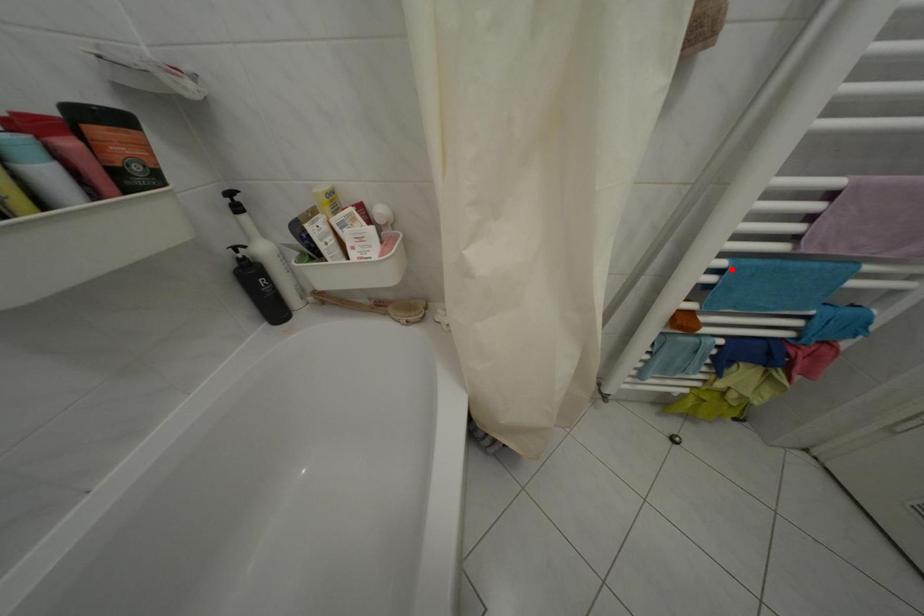
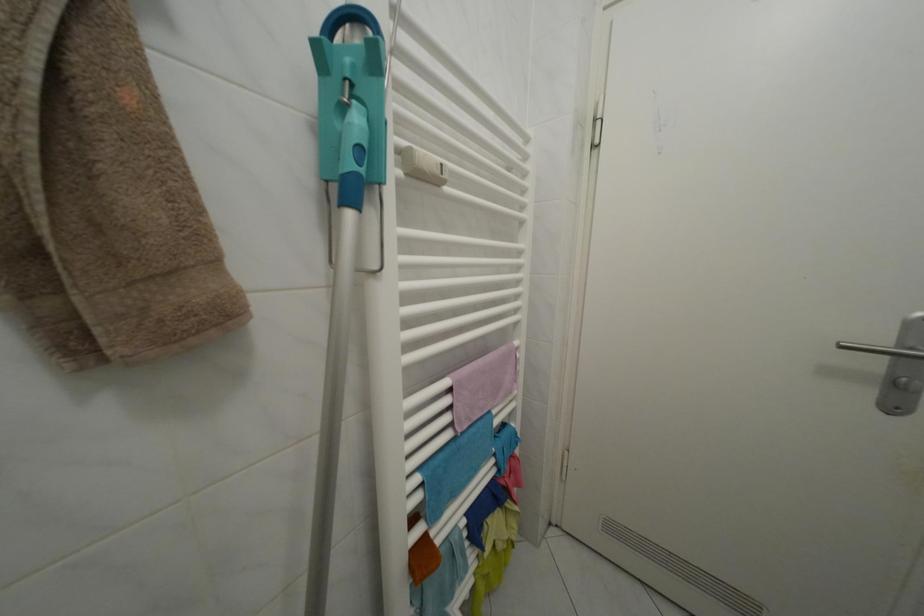
Question: I am providing you with two images of the same scene from different viewpoints. A red point is marked on the first image. At the location where the point appears in image 1, is it still visible in image 2?

Choices:
 (A) Yes
 (B) No

Answer: (A)